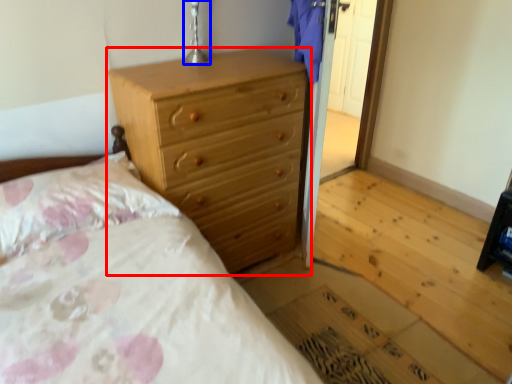
Question: Which object is further to the camera taking this photo, chest of drawers (highlighted by a red box) or table lamp (highlighted by a blue box)?

Choices:
 (A) chest of drawers
 (B) table lamp

Answer: (B)